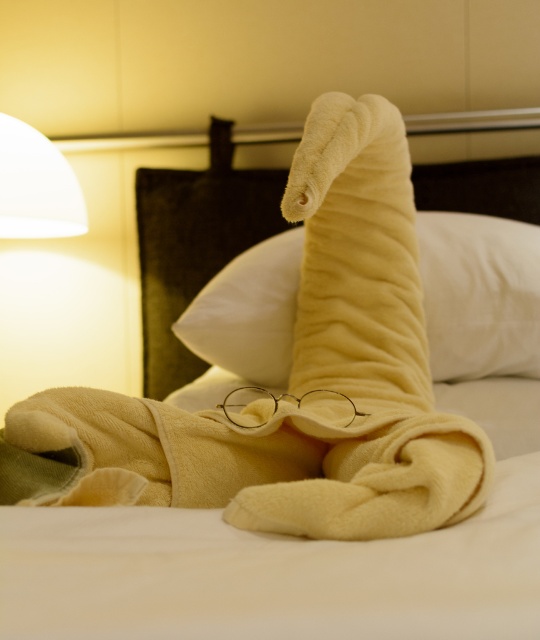
Question: In this image, where is yellow plush pillow at center located relative to white matte lampshade at upper left?

Choices:
 (A) above
 (B) below

Answer: (B)

Question: Which of the following is the farthest from the observer?

Choices:
 (A) (528, 305)
 (B) (50, 152)

Answer: (B)

Question: Which point is closer to the camera?

Choices:
 (A) yellow plush pillow at center
 (B) white matte lampshade at upper left

Answer: (A)

Question: Can you confirm if yellow plush pillow at center is positioned to the right of white matte lampshade at upper left?

Choices:
 (A) yes
 (B) no

Answer: (A)

Question: Can you confirm if yellow plush pillow at center is smaller than white matte lampshade at upper left?

Choices:
 (A) yes
 (B) no

Answer: (B)